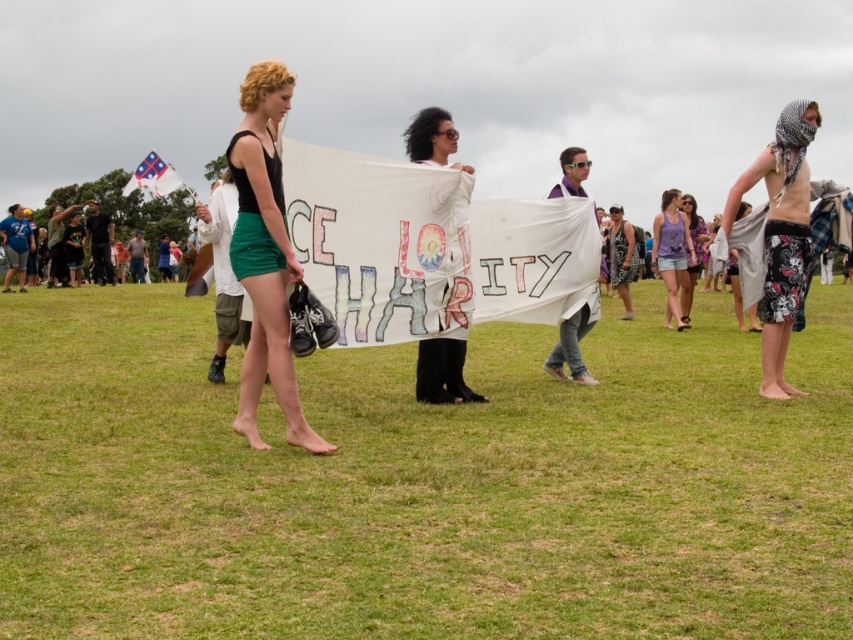
Measure the distance between point [270,234] and camera.

Point [270,234] and camera are 6.09 meters apart from each other.

Can you confirm if matte black tank top at center is shorter than purple fabric at center?

Incorrect, matte black tank top at center's height does not fall short of purple fabric at center's.

Who is more distant from viewer, (x=276, y=220) or (x=589, y=323)?

The point (x=589, y=323) is behind.

Locate an element on the screen. The height and width of the screenshot is (640, 853). matte black tank top at center is located at coordinates (265, 253).

Is matte black tank top at center shorter than black textured dress at center?

No, matte black tank top at center is not shorter than black textured dress at center.

Between point (270, 186) and point (619, 317), which one is positioned behind?

The point (619, 317) is behind.

The image size is (853, 640). Describe the element at coordinates (265, 253) in the screenshot. I see `matte black tank top at center` at that location.

I want to click on matte black tank top at center, so click(x=265, y=253).

In the scene shown: Does matte black tank top at center lie in front of purple cotton tank top at center?

Yes, it is.

Is point (271, 132) positioned behind point (664, 240)?

No, it is not.

Find the location of a particular element. The height and width of the screenshot is (640, 853). matte black tank top at center is located at coordinates (265, 253).